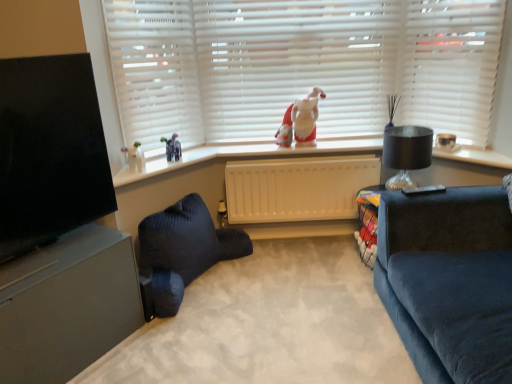
You are a GUI agent. You are given a task and a screenshot of the screen. Output one action in this format:
    pyautogui.click(x=<x>, y=<y>)
    Task: Click on the vacant area situated below black glossy tv at left (from a real-world perspective)
    
    Given the screenshot: What is the action you would take?
    pyautogui.click(x=73, y=242)